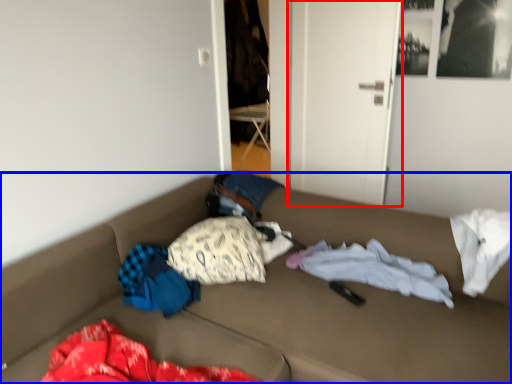
Question: Which object is further to the camera taking this photo, door (highlighted by a red box) or furniture (highlighted by a blue box)?

Choices:
 (A) door
 (B) furniture

Answer: (A)